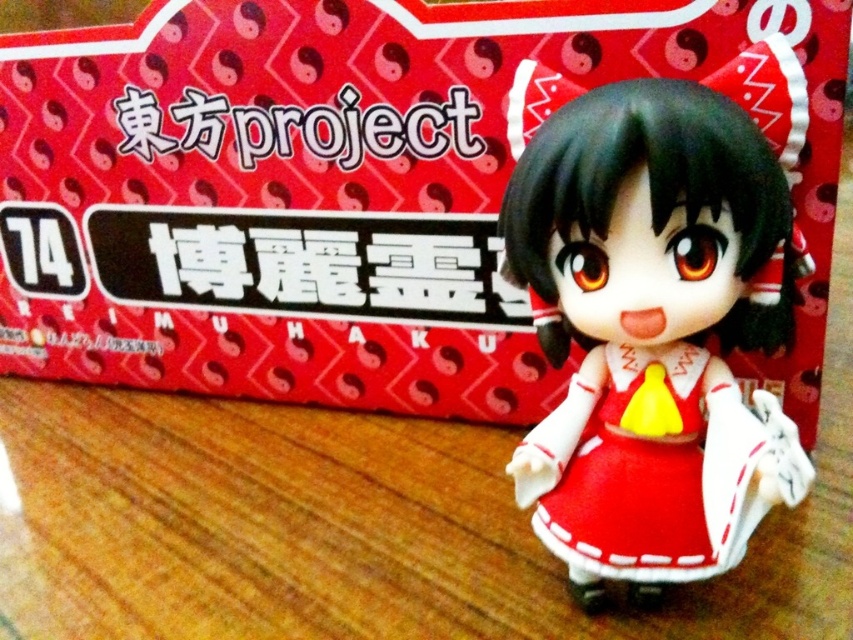
Which is below, matte red box at center or matte plastic figurine at center?

Positioned lower is matte plastic figurine at center.

Which of these two, matte red box at center or matte plastic figurine at center, stands shorter?

matte plastic figurine at center

Locate an element on the screen. The width and height of the screenshot is (853, 640). matte red box at center is located at coordinates (349, 188).

Does matte red box at center have a larger size compared to matte red dress at center?

Correct, matte red box at center is larger in size than matte red dress at center.

Describe the element at coordinates (349, 188) in the screenshot. I see `matte red box at center` at that location.

Image resolution: width=853 pixels, height=640 pixels. What do you see at coordinates (349, 188) in the screenshot?
I see `matte red box at center` at bounding box center [349, 188].

At what (x,y) coordinates should I click in order to perform the action: click on matte red box at center. Please return your answer as a coordinate pair (x, y). The width and height of the screenshot is (853, 640). Looking at the image, I should click on (349, 188).

Can you confirm if matte plastic figurine at center is positioned to the right of matte red dress at center?

Correct, you'll find matte plastic figurine at center to the right of matte red dress at center.

Can you confirm if matte plastic figurine at center is positioned below matte red dress at center?

Actually, matte plastic figurine at center is above matte red dress at center.

Image resolution: width=853 pixels, height=640 pixels. Describe the element at coordinates (647, 326) in the screenshot. I see `matte plastic figurine at center` at that location.

I want to click on matte plastic figurine at center, so click(647, 326).